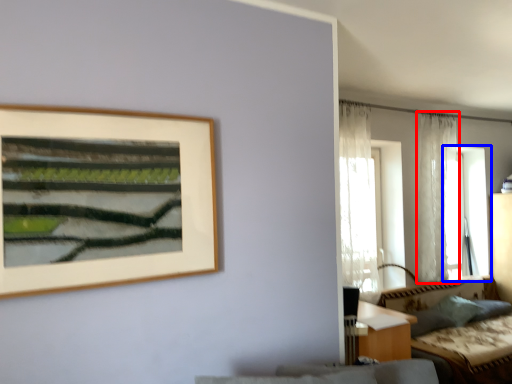
Question: Which of the following is the closest to the observer, curtain (highlighted by a red box) or window (highlighted by a blue box)?

Choices:
 (A) curtain
 (B) window

Answer: (A)